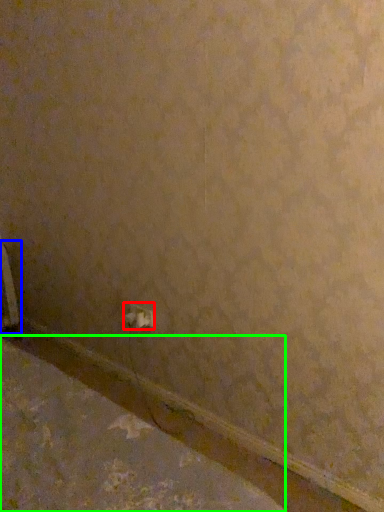
Question: Which is farther away from power plugs and sockets (highlighted by a red box)? radiator (highlighted by a blue box) or concrete (highlighted by a green box)?

Choices:
 (A) radiator
 (B) concrete

Answer: (A)